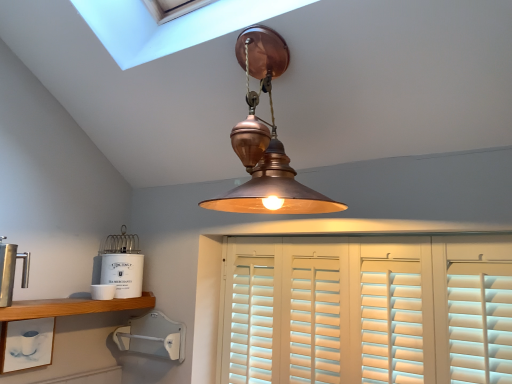
Question: Could you tell me if white plastic wall mount at lower left, the 4th appliance viewed from the top, is facing copper pendant light at center?

Choices:
 (A) yes
 (B) no

Answer: (B)

Question: Does white plastic wall mount at lower left, the 4th appliance viewed from the top, come behind copper pendant light at center?

Choices:
 (A) yes
 (B) no

Answer: (A)

Question: Is copper pendant light at center at the back of white plastic wall mount at lower left, the 4th appliance viewed from the top?

Choices:
 (A) no
 (B) yes

Answer: (A)

Question: Considering the relative sizes of white plastic wall mount at lower left, the 4th appliance viewed from the top, and copper pendant light at center in the image provided, is white plastic wall mount at lower left, the 4th appliance viewed from the top, smaller than copper pendant light at center?

Choices:
 (A) no
 (B) yes

Answer: (B)

Question: Is copper pendant light at center located within white plastic wall mount at lower left, which ranks as the first appliance in bottom-to-top order?

Choices:
 (A) no
 (B) yes

Answer: (A)

Question: Considering the relative sizes of white plastic wall mount at lower left, the 4th appliance viewed from the top, and copper pendant light at center in the image provided, is white plastic wall mount at lower left, the 4th appliance viewed from the top, bigger than copper pendant light at center?

Choices:
 (A) no
 (B) yes

Answer: (A)

Question: From a real-world perspective, does white wood shutters at center sit lower than polished stainless steel coffee press at left, which ranks as the fourth appliance in bottom-to-top order?

Choices:
 (A) no
 (B) yes

Answer: (B)

Question: Could you tell me if white wood shutters at center is turned towards polished stainless steel coffee press at left, which ranks as the fourth appliance in bottom-to-top order?

Choices:
 (A) yes
 (B) no

Answer: (A)

Question: From the image's perspective, is white wood shutters at center located above polished stainless steel coffee press at left, which ranks as the fourth appliance in bottom-to-top order?

Choices:
 (A) no
 (B) yes

Answer: (A)

Question: Is white wood shutters at center not close to polished stainless steel coffee press at left, which ranks as the fourth appliance in bottom-to-top order?

Choices:
 (A) yes
 (B) no

Answer: (A)

Question: Is white wood shutters at center closer to camera compared to polished stainless steel coffee press at left, the 1th appliance viewed from the top?

Choices:
 (A) yes
 (B) no

Answer: (A)

Question: Would you say white wood shutters at center is outside polished stainless steel coffee press at left, which ranks as the fourth appliance in bottom-to-top order?

Choices:
 (A) yes
 (B) no

Answer: (A)

Question: Is polished stainless steel coffee press at left, the 1th appliance viewed from the top, thinner than white wood shutters at center?

Choices:
 (A) yes
 (B) no

Answer: (B)